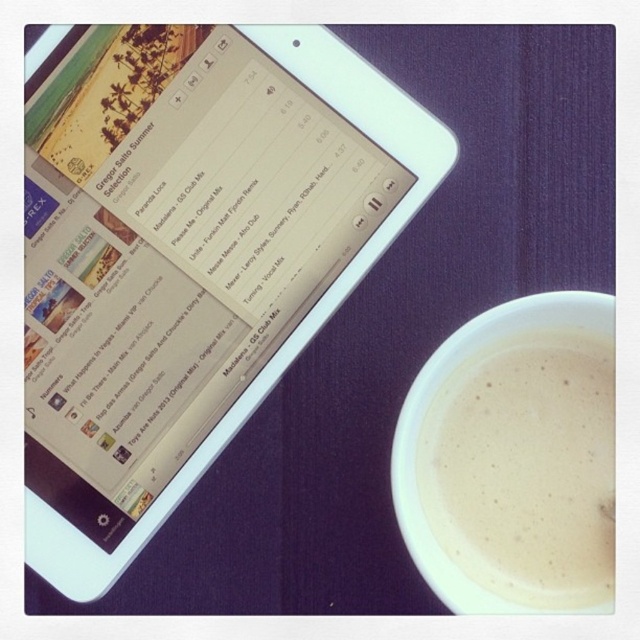
Question: Does white frothy coffee at lower right appear on the left side of white glossy tablet at upper left?

Choices:
 (A) no
 (B) yes

Answer: (A)

Question: Which point is closer to the camera?

Choices:
 (A) (276, 42)
 (B) (476, 440)

Answer: (B)

Question: Is white frothy coffee at lower right smaller than white glossy tablet at upper left?

Choices:
 (A) no
 (B) yes

Answer: (B)

Question: Can you confirm if white frothy coffee at lower right is smaller than white glossy tablet at upper left?

Choices:
 (A) no
 (B) yes

Answer: (B)

Question: Which object is closer to the camera taking this photo?

Choices:
 (A) white glossy tablet at upper left
 (B) white frothy coffee at lower right

Answer: (B)